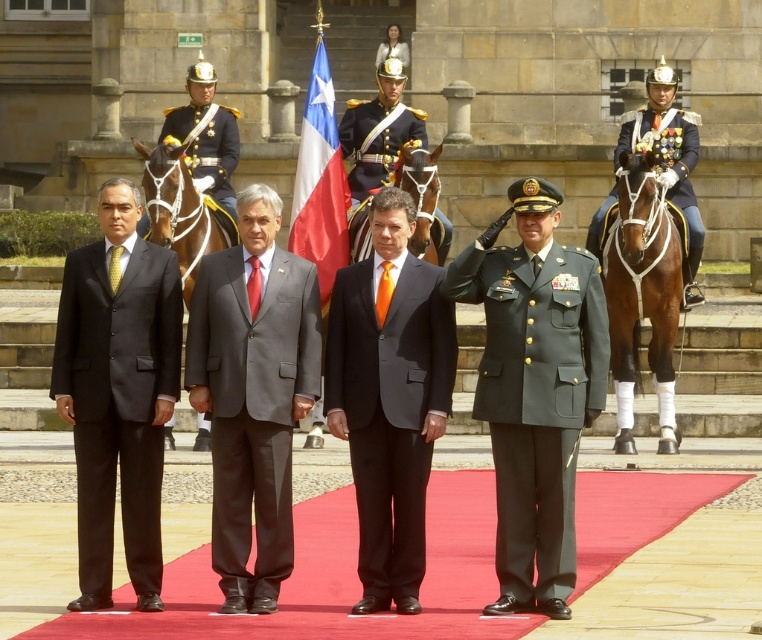
Does brown glossy horse at left have a greater height compared to shiny gold helmet at upper center?

Yes, brown glossy horse at left is taller than shiny gold helmet at upper center.

Consider the image. Can you confirm if brown glossy horse at left is positioned above shiny gold helmet at upper center?

Incorrect, brown glossy horse at left is not positioned above shiny gold helmet at upper center.

Who is more forward, (165, 144) or (218, 106)?

Point (165, 144) is in front.

Where is `brown glossy horse at left`? Image resolution: width=762 pixels, height=640 pixels. brown glossy horse at left is located at coordinates (181, 211).

Is point (221, 196) less distant than point (418, 172)?

That is False.

Between shiny gold helmet at upper center and brown leather horse at center, which one is positioned lower?

brown leather horse at center is lower down.

Describe the element at coordinates (207, 132) in the screenshot. The height and width of the screenshot is (640, 762). I see `shiny gold helmet at upper center` at that location.

Identify the location of shiny gold helmet at upper center. (207, 132).

Can you confirm if green military uniform at center is thinner than red fabric flag at center?

Yes, green military uniform at center is thinner than red fabric flag at center.

In the scene shown: Which is below, green military uniform at center or red fabric flag at center?

green military uniform at center is below.

This screenshot has width=762, height=640. Describe the element at coordinates (533, 388) in the screenshot. I see `green military uniform at center` at that location.

Identify the location of green military uniform at center. (533, 388).